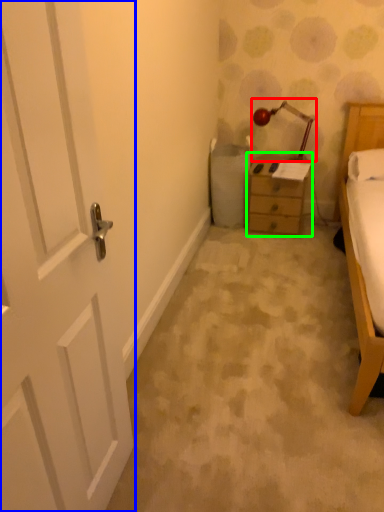
Question: Which object is positioned closest to lamp (highlighted by a red box)? Select from door (highlighted by a blue box) and nightstand (highlighted by a green box).

Choices:
 (A) door
 (B) nightstand

Answer: (B)